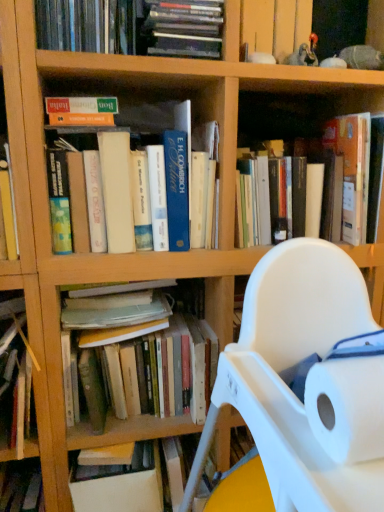
Question: Is hardcover book at center, the 3th book positioned from the top, closer to the viewer compared to hardcover books at upper center, the 6th book from the bottom?

Choices:
 (A) yes
 (B) no

Answer: (B)

Question: Can you confirm if hardcover book at center, the 3th book positioned from the top, is shorter than hardcover books at upper center, the 6th book from the bottom?

Choices:
 (A) no
 (B) yes

Answer: (A)

Question: Does hardcover book at center, the 3th book positioned from the top, lie behind hardcover books at upper center, the 6th book from the bottom?

Choices:
 (A) yes
 (B) no

Answer: (A)

Question: Can we say hardcover book at center, the fourth book ordered from the bottom, lies outside hardcover books at upper center, the 6th book from the bottom?

Choices:
 (A) no
 (B) yes

Answer: (B)

Question: Would you say hardcover book at center, the 3th book positioned from the top, contains hardcover books at upper center, the first book positioned from the top?

Choices:
 (A) yes
 (B) no

Answer: (B)

Question: Would you say hardcover book at lower left, which is the second book in bottom-to-top order, is inside or outside matte green book at upper left, placed as the fifth book when sorted from bottom to top?

Choices:
 (A) inside
 (B) outside

Answer: (B)

Question: In the image, is hardcover book at lower left, which is the second book in bottom-to-top order, on the left side or the right side of matte green book at upper left, which is counted as the second book, starting from the top?

Choices:
 (A) left
 (B) right

Answer: (A)

Question: In the image, is hardcover book at lower left, which is the second book in bottom-to-top order, positioned in front of or behind matte green book at upper left, placed as the fifth book when sorted from bottom to top?

Choices:
 (A) front
 (B) behind

Answer: (B)

Question: Looking at the image, does hardcover book at lower left, marked as the fifth book in a top-to-bottom arrangement, seem bigger or smaller compared to matte green book at upper left, which is counted as the second book, starting from the top?

Choices:
 (A) small
 (B) big

Answer: (B)

Question: From a real-world perspective, relative to hardcover books at upper left, which appears as the third book when ordered from the bottom, is white plastic chair at center vertically above or below?

Choices:
 (A) above
 (B) below

Answer: (B)

Question: In the image, is white plastic chair at center positioned in front of or behind hardcover books at upper left, which appears as the third book when ordered from the bottom?

Choices:
 (A) behind
 (B) front

Answer: (B)

Question: Is point (251, 373) positioned closer to the camera than point (195, 208)?

Choices:
 (A) farther
 (B) closer

Answer: (B)

Question: Would you say white plastic chair at center is inside or outside hardcover books at upper left, arranged as the 4th book when viewed from the top?

Choices:
 (A) outside
 (B) inside

Answer: (A)

Question: Looking at the image, does matte green book at upper left, placed as the fifth book when sorted from bottom to top, seem bigger or smaller compared to hardcover books at upper left, arranged as the 4th book when viewed from the top?

Choices:
 (A) big
 (B) small

Answer: (B)

Question: Relative to hardcover books at upper left, arranged as the 4th book when viewed from the top, is matte green book at upper left, placed as the fifth book when sorted from bottom to top, in front or behind?

Choices:
 (A) behind
 (B) front

Answer: (B)